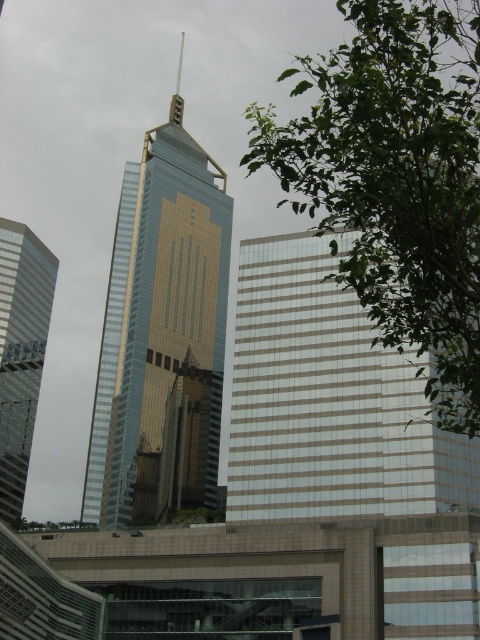
The image size is (480, 640). Describe the element at coordinates (328, 403) in the screenshot. I see `white glass building at center` at that location.

At what (x,y) coordinates should I click in order to perform the action: click on white glass building at center. Please return your answer as a coordinate pair (x, y). Looking at the image, I should click on (328, 403).

Does green leafy tree at center have a lesser height compared to gold reflective glass tower at center?

Yes, green leafy tree at center is shorter than gold reflective glass tower at center.

Can you confirm if green leafy tree at center is bigger than gold reflective glass tower at center?

Indeed, green leafy tree at center has a larger size compared to gold reflective glass tower at center.

Between point (394, 35) and point (106, 476), which one is positioned in front?

Point (394, 35)

Image resolution: width=480 pixels, height=640 pixels. In order to click on green leafy tree at center in this screenshot , I will do click(396, 180).

Can you confirm if gold reflective glass tower at center is bigger than silver reflective glass skyscraper at left?

Correct, gold reflective glass tower at center is larger in size than silver reflective glass skyscraper at left.

In the scene shown: Does gold reflective glass tower at center come in front of silver reflective glass skyscraper at left?

Yes, it is.

Does point (183, 451) come behind point (29, 284)?

No, it is in front of (29, 284).

What are the coordinates of `gold reflective glass tower at center` in the screenshot? It's located at (162, 336).